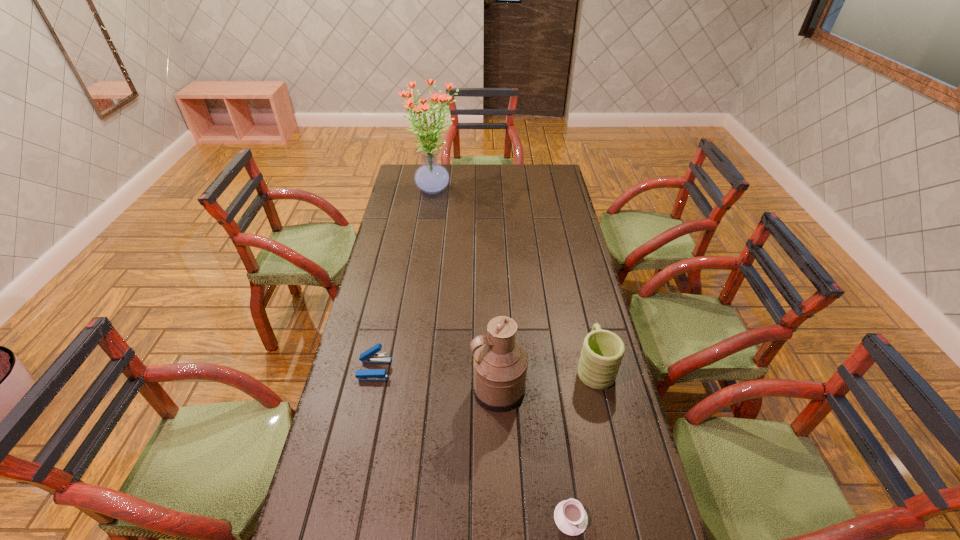
Locate an element on the screen. vacant space that satisfies the following two spatial constraints: 1. on the back side of the stapler; 2. on the right side of the tallest object is located at coordinates (413, 189).

Locate an element on the screen. free location that satisfies the following two spatial constraints: 1. on the front side of the stapler; 2. on the left side of the pitcher is located at coordinates (370, 390).